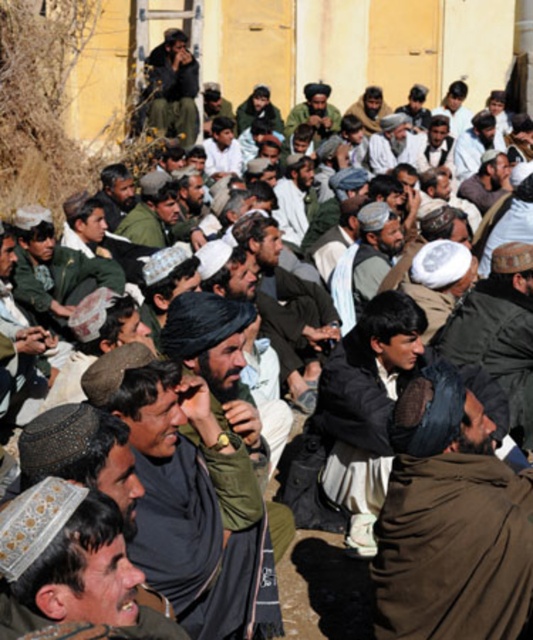
Is brown woolen jacket at center above dark brown woolen cap at center?

Yes.

Is point (321, 413) closer to viewer compared to point (518, 316)?

Yes, it is.

You are a GUI agent. You are given a task and a screenshot of the screen. Output one action in this format:
    pyautogui.click(x=<x>, y=<y>)
    Task: Click on the brown woolen jacket at center
    The width and height of the screenshot is (533, 640).
    Given the screenshot: What is the action you would take?
    pyautogui.click(x=365, y=410)

From the picture: Who is positioned more to the left, brown woolen jacket at center or dark green uniform at upper center?

From the viewer's perspective, dark green uniform at upper center appears more on the left side.

Is brown woolen jacket at center below dark green uniform at upper center?

Yes.

I want to click on brown woolen jacket at center, so click(365, 410).

Who is positioned more to the left, brown woolen turban at center or dark green uniform at upper center?

Positioned to the left is dark green uniform at upper center.

Is brown woolen turban at center bigger than dark green uniform at upper center?

Incorrect, brown woolen turban at center is not larger than dark green uniform at upper center.

Is point (392, 531) positioned after point (185, 129)?

No, (392, 531) is in front of (185, 129).

This screenshot has height=640, width=533. What are the coordinates of `brown woolen turban at center` in the screenshot? It's located at (450, 522).